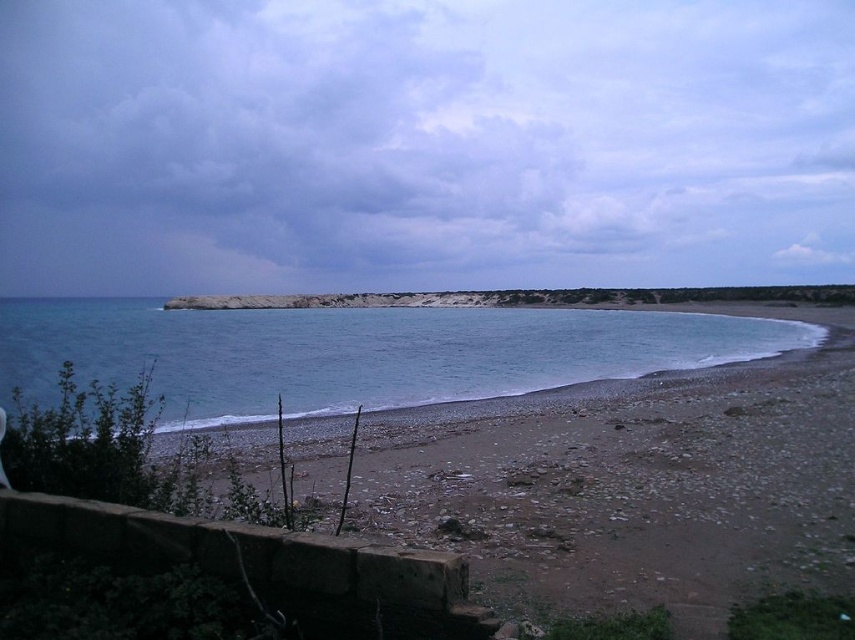
Question: Considering the relative positions of smooth sand beach at lower right and blue water at lower left in the image provided, where is smooth sand beach at lower right located with respect to blue water at lower left?

Choices:
 (A) right
 (B) left

Answer: (A)

Question: Is smooth sand beach at lower right closer to camera compared to blue water at lower left?

Choices:
 (A) no
 (B) yes

Answer: (B)

Question: Is smooth sand beach at lower right bigger than blue water at lower left?

Choices:
 (A) no
 (B) yes

Answer: (A)